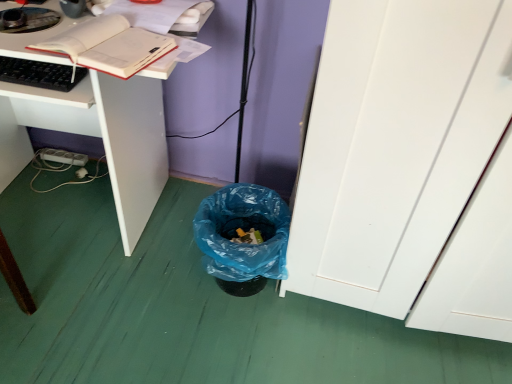
This screenshot has width=512, height=384. I want to click on vacant space underneath blue plastic trash can at lower center (from a real-world perspective), so click(233, 294).